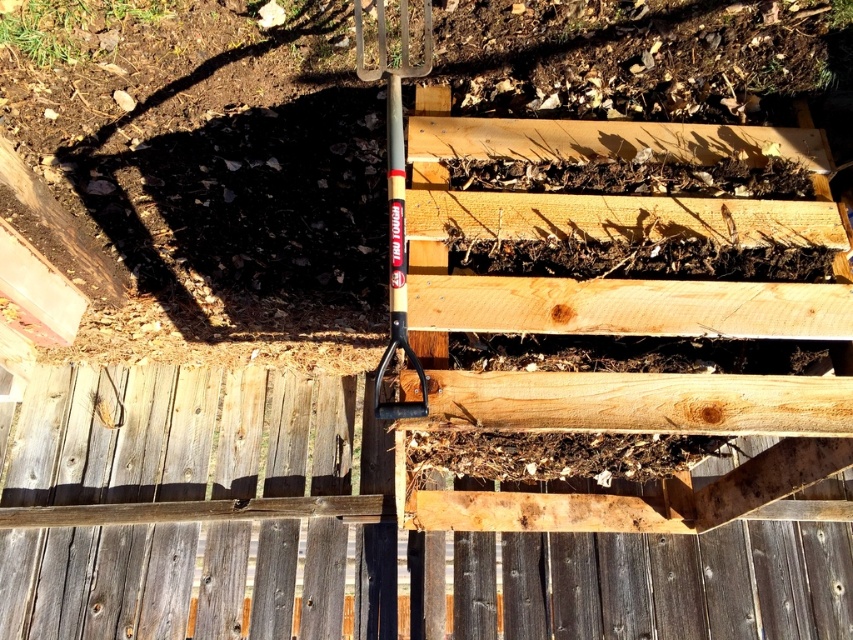
Question: Is weathered wood fence at center to the left of wooden handle shovel at center from the viewer's perspective?

Choices:
 (A) yes
 (B) no

Answer: (B)

Question: Which point is closer to the camera?

Choices:
 (A) (421, 68)
 (B) (320, 419)

Answer: (A)

Question: Which object is closer to the camera taking this photo?

Choices:
 (A) weathered wood fence at center
 (B) wooden handle shovel at center

Answer: (B)

Question: Which of the following is the closest to the observer?

Choices:
 (A) (793, 624)
 (B) (410, 76)

Answer: (B)

Question: Observing the image, what is the correct spatial positioning of weathered wood fence at center in reference to wooden handle shovel at center?

Choices:
 (A) above
 (B) below

Answer: (B)

Question: Does weathered wood fence at center appear on the left side of wooden handle shovel at center?

Choices:
 (A) yes
 (B) no

Answer: (B)